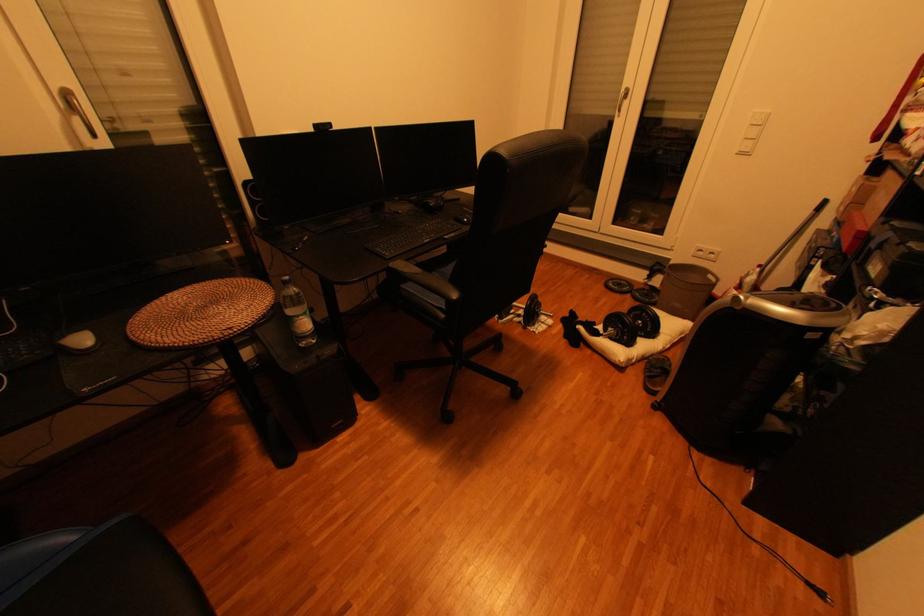
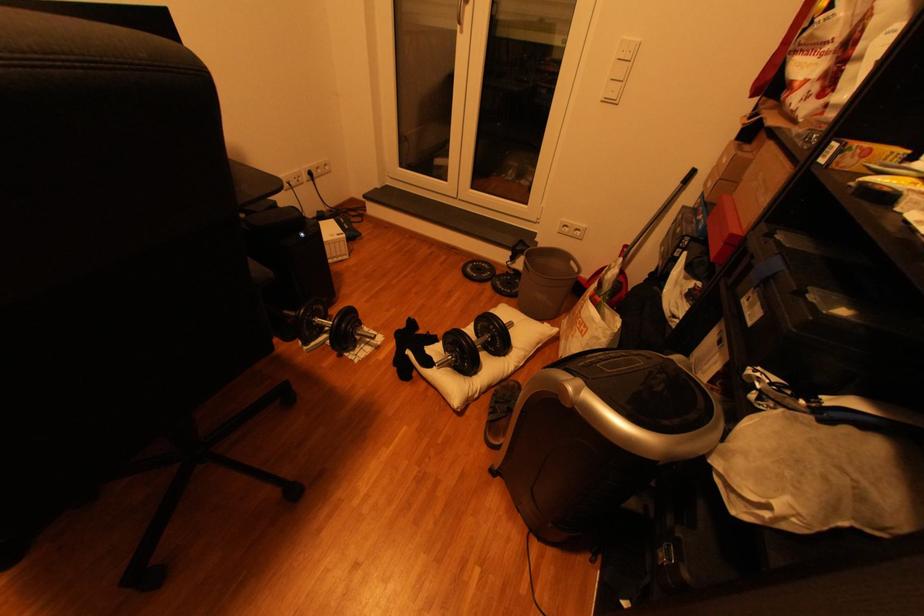
Where in the second image is the point corresponding to (658,301) from the first image?

(518, 292)